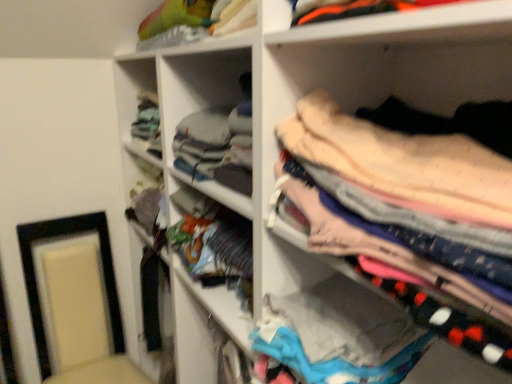
You are a GUI agent. You are given a task and a screenshot of the screen. Output one action in this format:
    pyautogui.click(x=<x>, y=<y>)
    Task: Click on the soft pink fabric at upper right
    This screenshot has height=384, width=512.
    Given the screenshot: What is the action you would take?
    pyautogui.click(x=413, y=204)

Describe the element at coordinates (413, 204) in the screenshot. This screenshot has height=384, width=512. I see `soft pink fabric at upper right` at that location.

The width and height of the screenshot is (512, 384). In order to click on matte black picture frame at lower left in this screenshot , I will do `click(36, 278)`.

Consider the image. In order to face matte black picture frame at lower left, should I rotate leftwards or rightwards?

Rotate your view left by about 21.571°.

This screenshot has width=512, height=384. What do you see at coordinates (36, 278) in the screenshot?
I see `matte black picture frame at lower left` at bounding box center [36, 278].

I want to click on soft pink fabric at upper right, so click(x=413, y=204).

Considering the relative positions of matte black picture frame at lower left and soft pink fabric at upper right in the image provided, is matte black picture frame at lower left to the left or to the right of soft pink fabric at upper right?

In the image, matte black picture frame at lower left appears on the left side of soft pink fabric at upper right.

Is matte black picture frame at lower left in front of or behind soft pink fabric at upper right in the image?

Clearly, matte black picture frame at lower left is behind soft pink fabric at upper right.

Is point (101, 230) farther from viewer compared to point (503, 152)?

Yes, point (101, 230) is farther from viewer.

From the image's perspective, which is below, matte black picture frame at lower left or soft pink fabric at upper right?

From the image's view, matte black picture frame at lower left is below.

From a real-world perspective, between matte black picture frame at lower left and soft pink fabric at upper right, who is vertically higher?

In real-world perspective, soft pink fabric at upper right is above.

Can you confirm if matte black picture frame at lower left is thinner than soft pink fabric at upper right?

Incorrect, the width of matte black picture frame at lower left is not less than that of soft pink fabric at upper right.

Does matte black picture frame at lower left have a lesser height compared to soft pink fabric at upper right?

No.

Considering the relative sizes of matte black picture frame at lower left and soft pink fabric at upper right in the image provided, is matte black picture frame at lower left smaller than soft pink fabric at upper right?

No, matte black picture frame at lower left is not smaller than soft pink fabric at upper right.

Is matte black picture frame at lower left outside of soft pink fabric at upper right?

That's correct, matte black picture frame at lower left is outside of soft pink fabric at upper right.

Are matte black picture frame at lower left and soft pink fabric at upper right making contact?

matte black picture frame at lower left and soft pink fabric at upper right are clearly separated.

Is matte black picture frame at lower left facing away from soft pink fabric at upper right?

No.

How many degrees apart are the facing directions of matte black picture frame at lower left and soft pink fabric at upper right?

93.3 degrees.

I want to click on clothing in front of the matte black picture frame at lower left, so click(413, 204).

Is soft pink fabric at upper right at the right side of matte black picture frame at lower left?

Indeed, soft pink fabric at upper right is positioned on the right side of matte black picture frame at lower left.

Is soft pink fabric at upper right behind matte black picture frame at lower left?

No.

Does point (508, 362) come closer to viewer compared to point (116, 286)?

That is True.

From the picture: From the image's perspective, is soft pink fabric at upper right located above or below matte black picture frame at lower left?

Clearly, from the image's perspective, soft pink fabric at upper right is above matte black picture frame at lower left.

From a real-world perspective, is soft pink fabric at upper right under matte black picture frame at lower left?

Actually, soft pink fabric at upper right is physically above matte black picture frame at lower left in the real world.

Which of these two, soft pink fabric at upper right or matte black picture frame at lower left, is thinner?

Thinner between the two is soft pink fabric at upper right.

Which of these two, soft pink fabric at upper right or matte black picture frame at lower left, stands shorter?

soft pink fabric at upper right.

Is soft pink fabric at upper right bigger than matte black picture frame at lower left?

Incorrect, soft pink fabric at upper right is not larger than matte black picture frame at lower left.

Which is correct: soft pink fabric at upper right is inside matte black picture frame at lower left, or outside of it?

soft pink fabric at upper right is not enclosed by matte black picture frame at lower left.

Is soft pink fabric at upper right directly adjacent to matte black picture frame at lower left?

soft pink fabric at upper right and matte black picture frame at lower left are clearly separated.

Could you tell me if soft pink fabric at upper right is facing matte black picture frame at lower left?

No.

Can you tell me how much soft pink fabric at upper right and matte black picture frame at lower left differ in facing direction?

93.3 degrees separate the facing orientations of soft pink fabric at upper right and matte black picture frame at lower left.

How distant is soft pink fabric at upper right from matte black picture frame at lower left?

They are 1.40 meters apart.

Locate an element on the screen. This screenshot has width=512, height=384. picture frame behind the soft pink fabric at upper right is located at coordinates (36, 278).

Find the location of `picture frame below the soft pink fabric at upper right (from a real-world perspective)`. picture frame below the soft pink fabric at upper right (from a real-world perspective) is located at coordinates (36, 278).

At what (x,y) coordinates should I click in order to perform the action: click on clothing above the matte black picture frame at lower left (from a real-world perspective). Please return your answer as a coordinate pair (x, y). The width and height of the screenshot is (512, 384). Looking at the image, I should click on (413, 204).